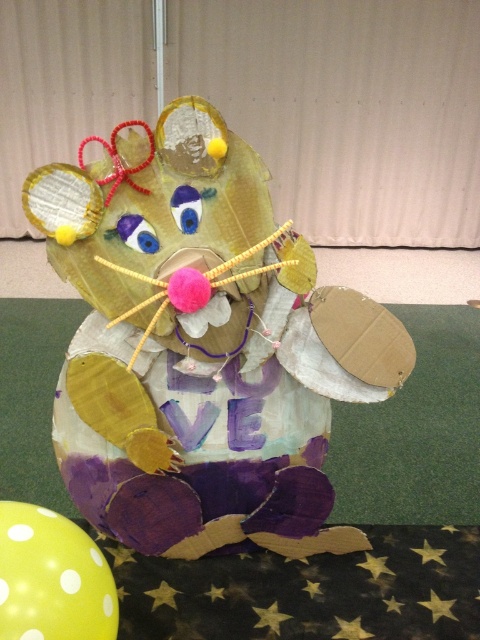
Question: Among these objects, which one is nearest to the camera?

Choices:
 (A) cardboard mouse at center
 (B) yellow dotted balloon at lower left

Answer: (B)

Question: Is cardboard mouse at center to the left of yellow dotted balloon at lower left from the viewer's perspective?

Choices:
 (A) yes
 (B) no

Answer: (B)

Question: Can you confirm if cardboard mouse at center is positioned to the right of yellow dotted balloon at lower left?

Choices:
 (A) yes
 (B) no

Answer: (A)

Question: Is cardboard mouse at center further to the viewer compared to yellow dotted balloon at lower left?

Choices:
 (A) yes
 (B) no

Answer: (A)